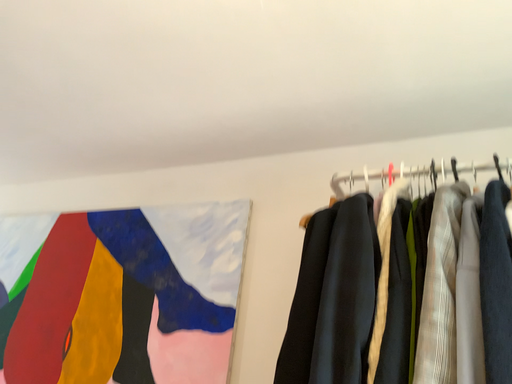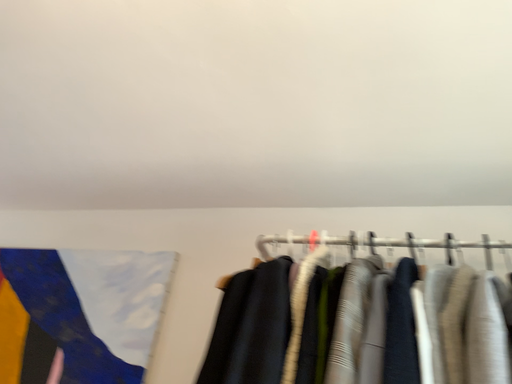
Question: Which way did the camera rotate in the video?

Choices:
 (A) rotated right
 (B) rotated left

Answer: (A)